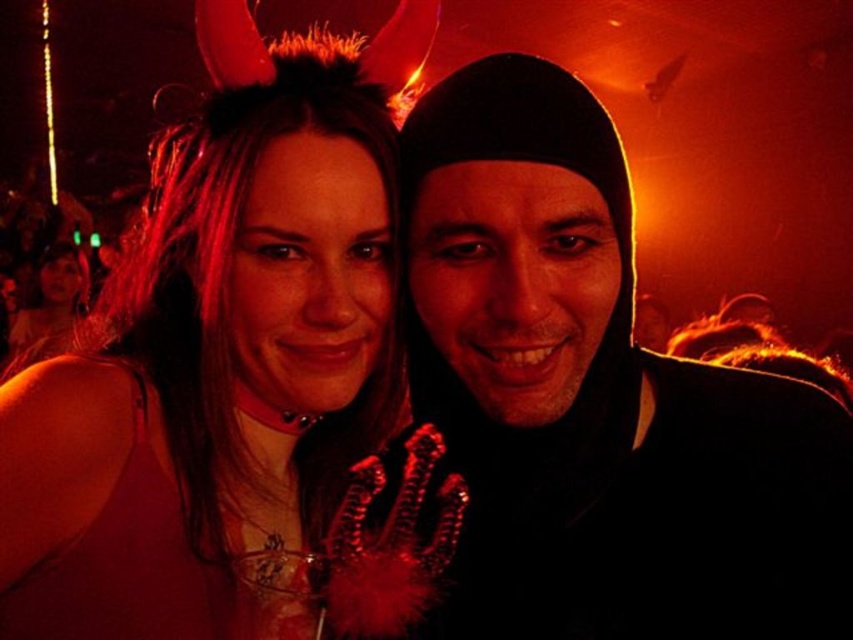
Which of these two, black matte beanie at center or matte black hair at center, stands taller?

matte black hair at center is taller.

Can you confirm if black matte beanie at center is taller than matte black hair at center?

No, black matte beanie at center is not taller than matte black hair at center.

What do you see at coordinates (596, 397) in the screenshot?
I see `black matte beanie at center` at bounding box center [596, 397].

Identify the location of black matte beanie at center. The height and width of the screenshot is (640, 853). coord(596,397).